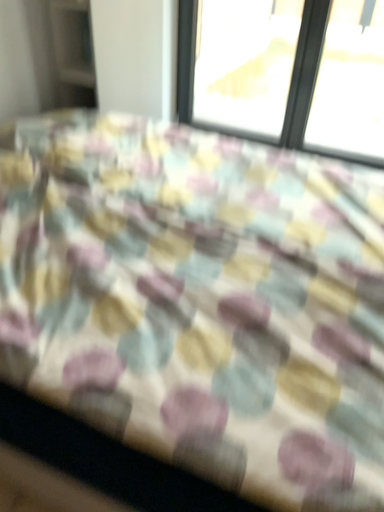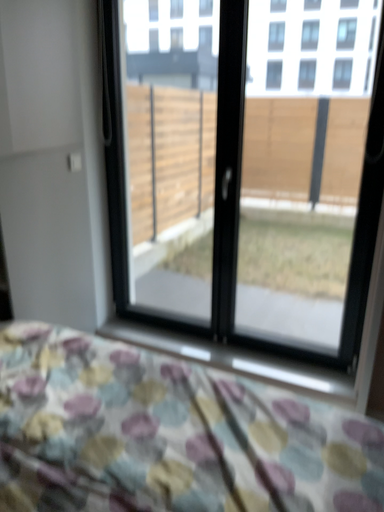
Question: How did the camera likely rotate when shooting the video?

Choices:
 (A) rotated downward
 (B) rotated upward

Answer: (B)